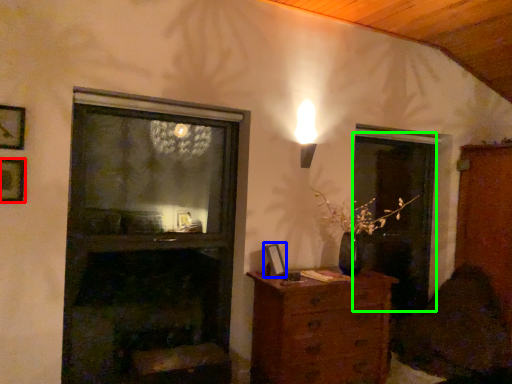
Question: Which object is positioned farthest from picture frame (highlighted by a red box)? Select from picture frame (highlighted by a blue box) and screen door (highlighted by a green box).

Choices:
 (A) picture frame
 (B) screen door

Answer: (B)